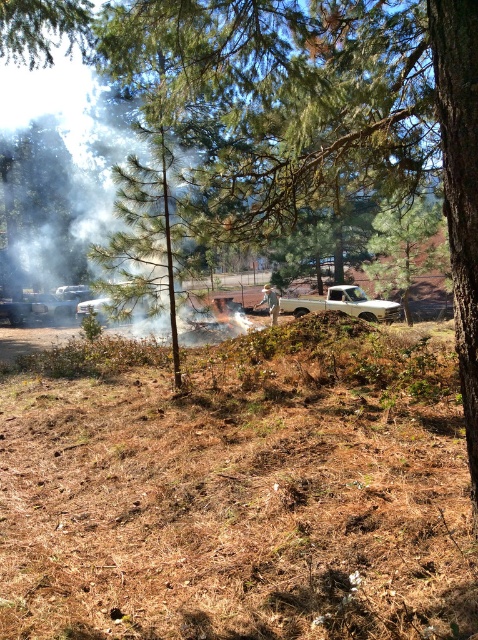
Question: Which of these objects is positioned closest to the brushed metal car at lower left?

Choices:
 (A) metallic silver car at left
 (B) white matte truck at center
 (C) green leafy tree at upper left
 (D) brown dry grass at center

Answer: (A)

Question: Which point is closer to the camera?

Choices:
 (A) (83, 140)
 (B) (359, 300)
 (C) (53, 22)
 (D) (432, 570)

Answer: (D)

Question: Can you confirm if brushed metal car at lower left is positioned to the left of metallic silver car at left?

Choices:
 (A) no
 (B) yes

Answer: (B)

Question: Is white smoke at center positioned in front of metallic silver car at left?

Choices:
 (A) yes
 (B) no

Answer: (A)

Question: Which object appears closest to the camera in this image?

Choices:
 (A) white matte truck at center
 (B) green leafy tree at upper left
 (C) metallic silver car at left

Answer: (B)

Question: Can you confirm if white smoke at center is positioned to the left of brushed metal car at lower left?

Choices:
 (A) no
 (B) yes

Answer: (A)